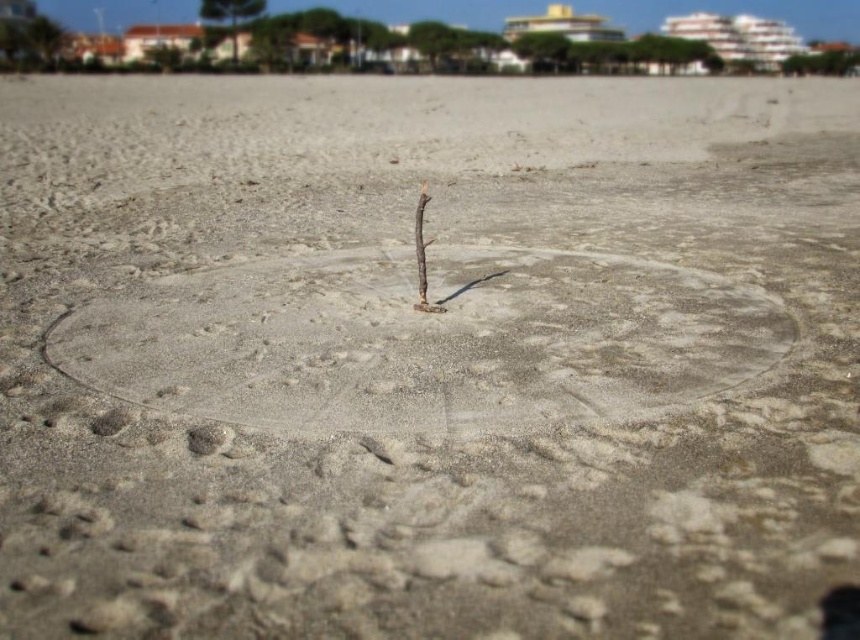
You are a child trying to place a 3 meter long wooden plank between the smooth sand circle at center and the green trees in the background. Can you fit the plank between them without bending it?

The distance between the smooth sand circle at center and the green trees in the background is 2.74 meters. Since the plank is 3 meters long, it is longer than the available space. Therefore, the plank cannot be placed straight between them without bending.

You are standing on the sandy beach and see the point marked at coordinates (x=424, y=340). What object is located at that point?

The point at coordinates (x=424, y=340) corresponds to the smooth sand circle at center.

You are a beachcomber searching for items on the beach. You notice the smooth sand circle at center and the brown rough twig at center. Which object is taller when viewed from above?

The smooth sand circle at center is taller than the brown rough twig at center.